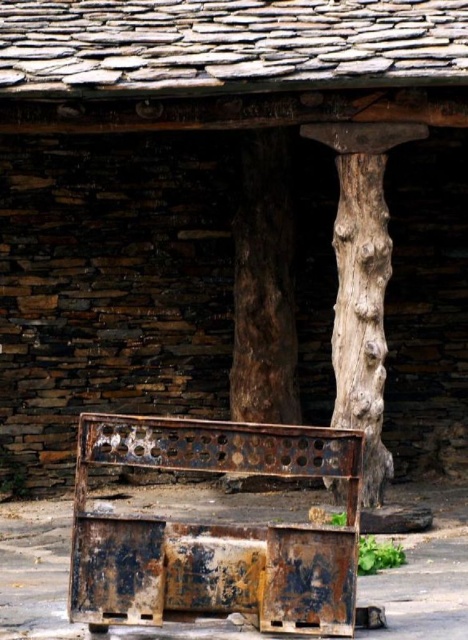
You are standing in front of the stone structure and want to touch both the brown rough tree trunk at center and the rough bark tree trunk at center. Which one should you reach for first?

You should reach for the brown rough tree trunk at center first because it is closer to you than the rough bark tree trunk at center, which is further away.

You are standing in front of the stone structure and notice two points marked on the image. Which point, point [261,532] or point [365,356], is nearer to you?

Point [261,532] is closer to the viewer than point [365,356].